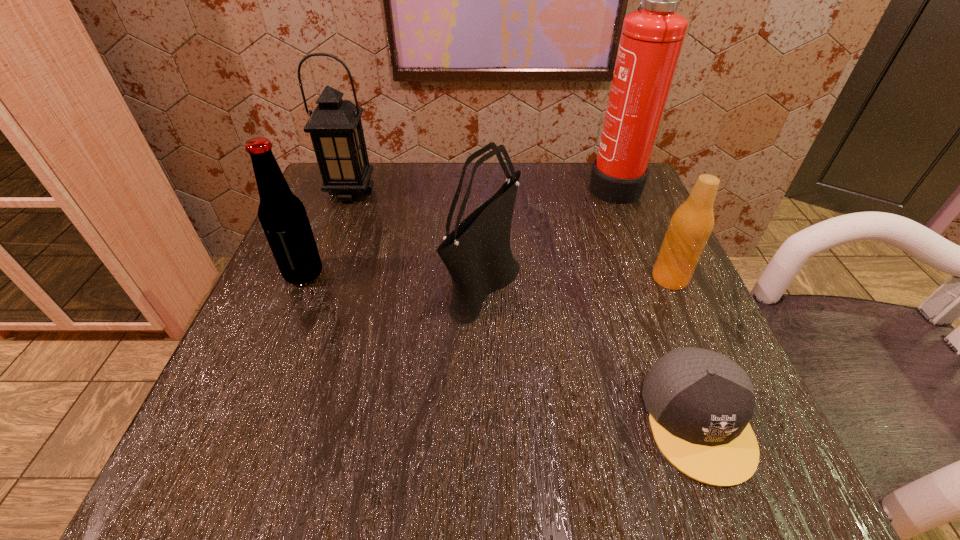
Where is `vacant region at the far left corner`? The height and width of the screenshot is (540, 960). vacant region at the far left corner is located at coordinates (327, 211).

In the image, there is a desktop. Where is `vacant space at the far right corner`? This screenshot has width=960, height=540. vacant space at the far right corner is located at coordinates (623, 217).

Identify the location of free space at the near right corner. Image resolution: width=960 pixels, height=540 pixels. (656, 461).

The width and height of the screenshot is (960, 540). I want to click on empty location between the tallest object and the cap, so pyautogui.click(x=656, y=302).

You are a GUI agent. You are given a task and a screenshot of the screen. Output one action in this format:
    pyautogui.click(x=<x>, y=<y>)
    Task: Click on the vacant space that is in between the shoulder bag and the fifth tallest object
    
    Given the screenshot: What is the action you would take?
    pyautogui.click(x=577, y=280)

This screenshot has width=960, height=540. Identify the location of vacant space that is in between the lantern and the right beer bottle. (511, 235).

What are the coordinates of `vacant space that's between the fire extinguisher and the fifth tallest object` in the screenshot? It's located at (x=641, y=231).

Image resolution: width=960 pixels, height=540 pixels. Find the location of `vacant space in between the shoulder bag and the fire extinguisher`. vacant space in between the shoulder bag and the fire extinguisher is located at coordinates (548, 233).

You are a GUI agent. You are given a task and a screenshot of the screen. Output one action in this format:
    pyautogui.click(x=<x>, y=<y>)
    Task: Click on the unoccupied area between the tallest object and the cap
    
    Given the screenshot: What is the action you would take?
    pyautogui.click(x=656, y=302)

Locate an element on the screen. This screenshot has width=960, height=540. the closest object to the tallest object is located at coordinates (691, 225).